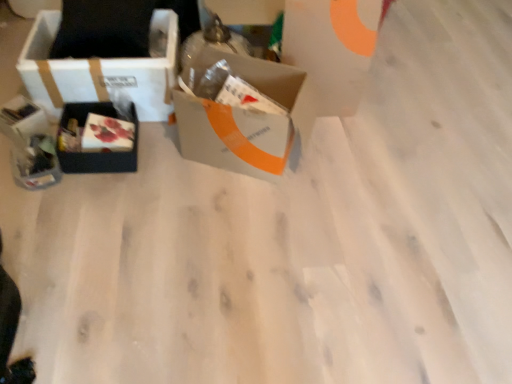
Find the location of `vacant area that lies between gray cardboard box at center, which is counted as the 3th box, starting from the left, and matte plastic box at center-left`. vacant area that lies between gray cardboard box at center, which is counted as the 3th box, starting from the left, and matte plastic box at center-left is located at coordinates (179, 159).